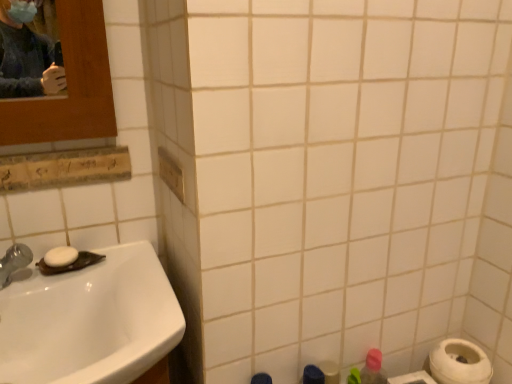
The height and width of the screenshot is (384, 512). What do you see at coordinates (373, 368) in the screenshot?
I see `pink matte bottle at lower right` at bounding box center [373, 368].

Measure the distance between white glossy sink at lower left and camera.

white glossy sink at lower left is 59.95 centimeters from camera.

I want to click on white glossy sink at lower left, so click(90, 321).

Find the location of a particular element. The width and height of the screenshot is (512, 384). white matte soap at sink left is located at coordinates (61, 256).

Where is `pink matte bottle at lower right`? pink matte bottle at lower right is located at coordinates (373, 368).

Could pink matte bottle at lower right be considered to be inside white matte soap at sink left?

No, pink matte bottle at lower right is not inside white matte soap at sink left.

From a real-world perspective, is white matte soap at sink left on pink matte bottle at lower right?

Correct, in the physical world, white matte soap at sink left is higher than pink matte bottle at lower right.

Can you confirm if white matte soap at sink left is wider than pink matte bottle at lower right?

Indeed, white matte soap at sink left has a greater width compared to pink matte bottle at lower right.

Consider the image. Considering the positions of objects white matte soap at sink left and pink matte bottle at lower right in the image provided, who is more to the right, white matte soap at sink left or pink matte bottle at lower right?

From the viewer's perspective, pink matte bottle at lower right appears more on the right side.

Is pink matte bottle at lower right inside white glossy sink at lower left?

No, pink matte bottle at lower right is not inside white glossy sink at lower left.

From a real-world perspective, is white glossy sink at lower left physically located above or below pink matte bottle at lower right?

In terms of real-world spatial position, white glossy sink at lower left is above pink matte bottle at lower right.

Can you confirm if white glossy sink at lower left is smaller than pink matte bottle at lower right?

No.

Could you tell me if white glossy sink at lower left is turned towards pink matte bottle at lower right?

No, white glossy sink at lower left is not oriented towards pink matte bottle at lower right.

Can you confirm if white matte toilet paper at lower right is thinner than white matte soap at sink left?

No, white matte toilet paper at lower right is not thinner than white matte soap at sink left.

Is white matte toilet paper at lower right bigger than white matte soap at sink left?

Correct, white matte toilet paper at lower right is larger in size than white matte soap at sink left.

Where is `soap to the left of white matte toilet paper at lower right`? The height and width of the screenshot is (384, 512). soap to the left of white matte toilet paper at lower right is located at coordinates (61, 256).

Which of these two, white matte toilet paper at lower right or white matte soap at sink left, stands shorter?

With less height is white matte soap at sink left.

Which of these two, pink matte bottle at lower right or white matte toilet paper at lower right, stands taller?

Standing taller between the two is pink matte bottle at lower right.

Considering the relative positions of pink matte bottle at lower right and white matte toilet paper at lower right in the image provided, is pink matte bottle at lower right to the left of white matte toilet paper at lower right from the viewer's perspective?

Indeed, pink matte bottle at lower right is positioned on the left side of white matte toilet paper at lower right.

From the image's perspective, would you say pink matte bottle at lower right is shown under white matte toilet paper at lower right?

Yes.

Which object is further away from the camera taking this photo, pink matte bottle at lower right or white matte toilet paper at lower right?

pink matte bottle at lower right is behind.

Is pink matte bottle at lower right positioned with its back to white glossy sink at lower left?

No, pink matte bottle at lower right is not facing away from white glossy sink at lower left.

Does pink matte bottle at lower right have a greater height compared to white glossy sink at lower left?

Yes.

From the image's perspective, is pink matte bottle at lower right located beneath white glossy sink at lower left?

Yes.

What's the angular difference between white matte toilet paper at lower right and white glossy sink at lower left's facing directions?

There is a 1.44-degree angle between the facing directions of white matte toilet paper at lower right and white glossy sink at lower left.

Consider the image. Is the depth of white matte toilet paper at lower right greater than that of white glossy sink at lower left?

Yes, the depth of white matte toilet paper at lower right is greater than that of white glossy sink at lower left.

Consider the image. Is white matte toilet paper at lower right taller or shorter than white glossy sink at lower left?

white matte toilet paper at lower right is shorter than white glossy sink at lower left.

Is white matte toilet paper at lower right far from white glossy sink at lower left?

No.

Would you say pink matte bottle at lower right is a long distance from white matte soap at sink left?

No, pink matte bottle at lower right is not far away from white matte soap at sink left.

Which object is closer to the camera taking this photo, pink matte bottle at lower right or white matte soap at sink left?

white matte soap at sink left is closer to the camera.

How far apart are pink matte bottle at lower right and white matte soap at sink left?

pink matte bottle at lower right and white matte soap at sink left are 27.77 inches apart from each other.

Locate an element on the screen. This screenshot has height=384, width=512. cleaning product lying on the right of white matte soap at sink left is located at coordinates (373, 368).

Image resolution: width=512 pixels, height=384 pixels. Find the location of `sink that appears above the pink matte bottle at lower right (from a real-world perspective)`. sink that appears above the pink matte bottle at lower right (from a real-world perspective) is located at coordinates (90, 321).

Estimate the real-world distances between objects in this image. Which object is further from white glossy sink at lower left, white matte soap at sink left or pink matte bottle at lower right?

pink matte bottle at lower right is further to white glossy sink at lower left.

Looking at the image, which one is located further to white glossy sink at lower left, pink matte bottle at lower right or white matte toilet paper at lower right?

Among the two, white matte toilet paper at lower right is located further to white glossy sink at lower left.

Considering their positions, is pink matte bottle at lower right positioned closer to white glossy sink at lower left than white matte soap at sink left?

white matte soap at sink left is closer to white glossy sink at lower left.

From the picture: Which object lies nearer to the anchor point white matte soap at sink left, white glossy sink at lower left or white matte toilet paper at lower right?

white glossy sink at lower left lies closer to white matte soap at sink left than the other object.

When comparing their distances from pink matte bottle at lower right, does white glossy sink at lower left or white matte toilet paper at lower right seem further?

The object further to pink matte bottle at lower right is white glossy sink at lower left.

In the scene shown: Estimate the real-world distances between objects in this image. Which object is closer to white glossy sink at lower left, white matte soap at sink left or white matte toilet paper at lower right?

white matte soap at sink left is closer to white glossy sink at lower left.

Considering their positions, is white matte soap at sink left positioned closer to white matte toilet paper at lower right than pink matte bottle at lower right?

The object closer to white matte toilet paper at lower right is pink matte bottle at lower right.

When comparing their distances from white matte toilet paper at lower right, does white matte soap at sink left or white glossy sink at lower left seem further?

white matte soap at sink left is positioned further to the anchor white matte toilet paper at lower right.

Where is `cleaning product between white matte soap at sink left and white matte toilet paper at lower right from left to right`? This screenshot has width=512, height=384. cleaning product between white matte soap at sink left and white matte toilet paper at lower right from left to right is located at coordinates [x=373, y=368].

Identify the location of sink between white matte soap at sink left and white matte toilet paper at lower right from left to right. The width and height of the screenshot is (512, 384). (90, 321).

Where is `sink situated between white matte soap at sink left and pink matte bottle at lower right from left to right`? This screenshot has width=512, height=384. sink situated between white matte soap at sink left and pink matte bottle at lower right from left to right is located at coordinates (90, 321).

This screenshot has width=512, height=384. What are the coordinates of `cleaning product between white glossy sink at lower left and white matte toilet paper at lower right` in the screenshot? It's located at (373, 368).